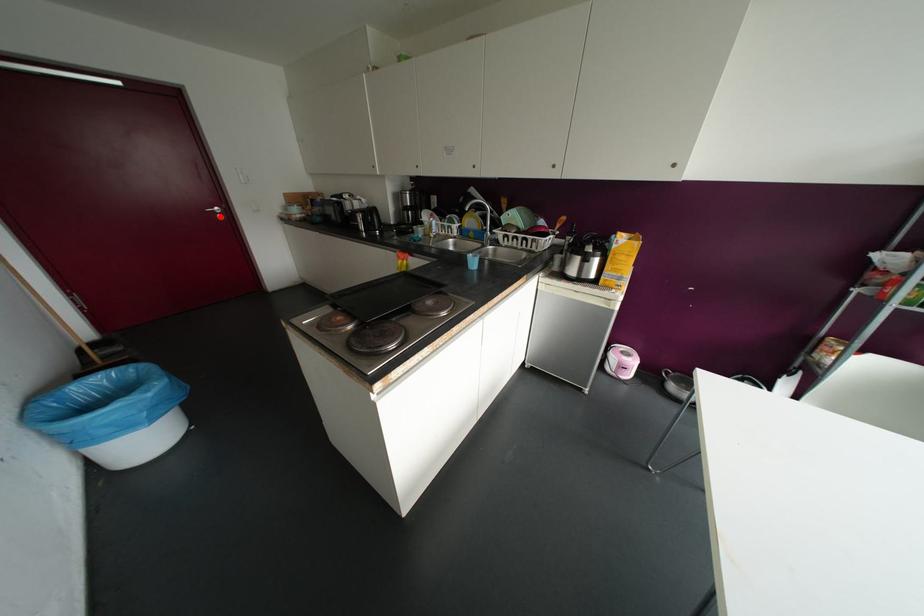
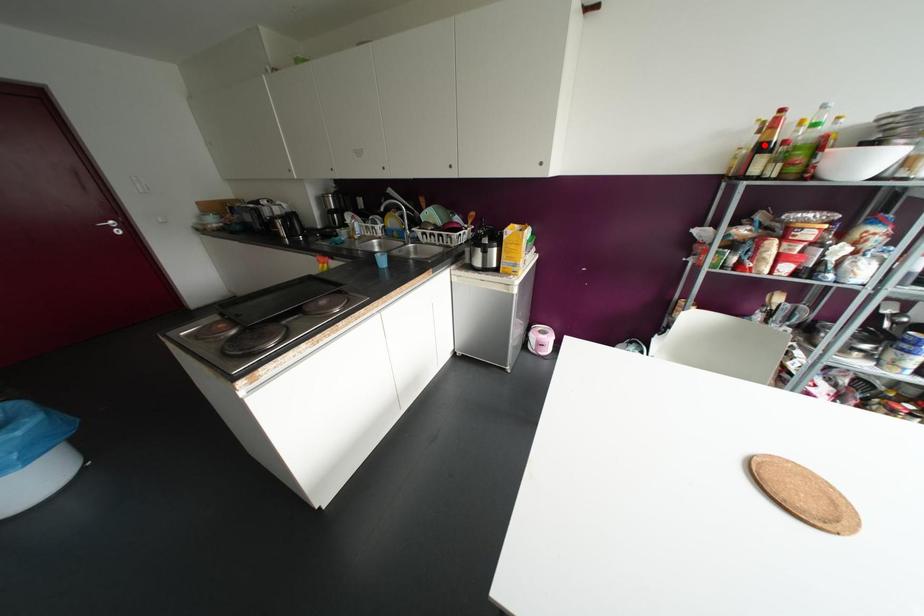
Based on the photo, I am providing you with two images of the same scene from different viewpoints. A red point is marked on the first image and another point is marked on the second image. Is the marked point in image1 the same physical position as the marked point in image2?

No